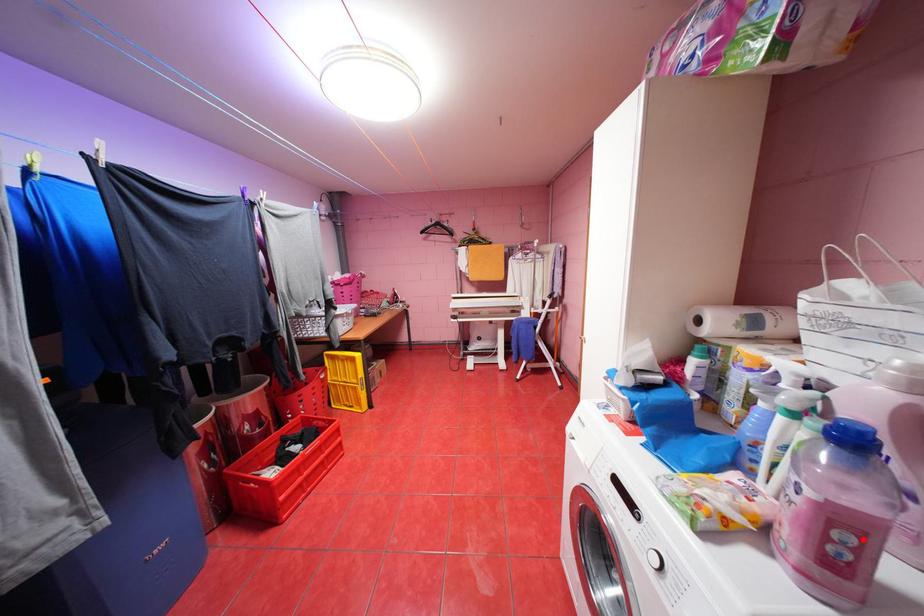
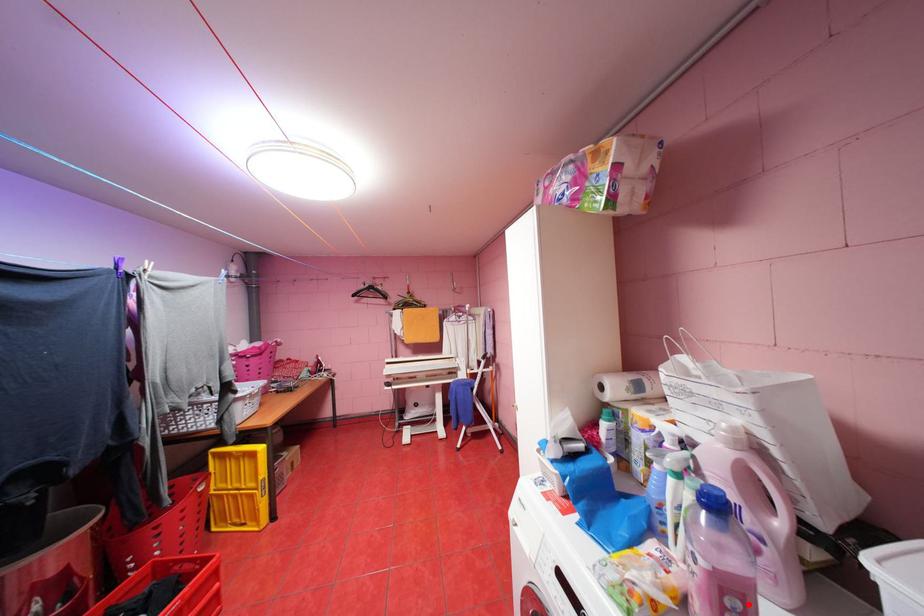
I am providing you with two images of the same scene from different viewpoints. A red point is marked on the first image and another point is marked on the second image. Is the marked point in image1 the same physical position as the marked point in image2?

Yes